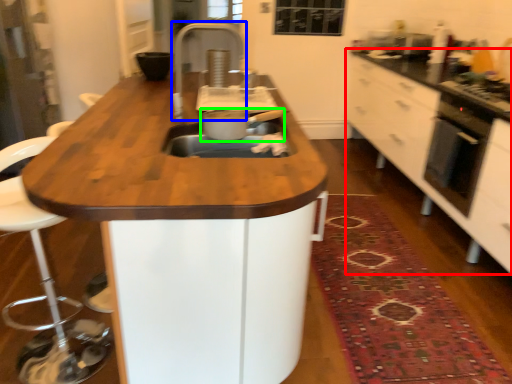
Question: Which object is positioned closest to cabinetry (highlighted by a red box)? Select from faucet (highlighted by a blue box) and kitchen appliance (highlighted by a green box).

Choices:
 (A) faucet
 (B) kitchen appliance

Answer: (A)